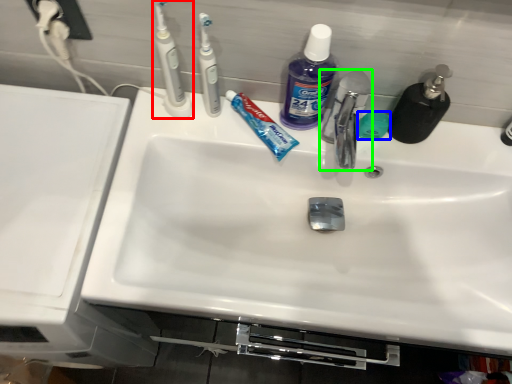
Question: Estimate the real-world distances between objects in this image. Which object is farther from toothbrush (highlighted by a red box), soap (highlighted by a blue box) or tap (highlighted by a green box)?

Choices:
 (A) soap
 (B) tap

Answer: (A)